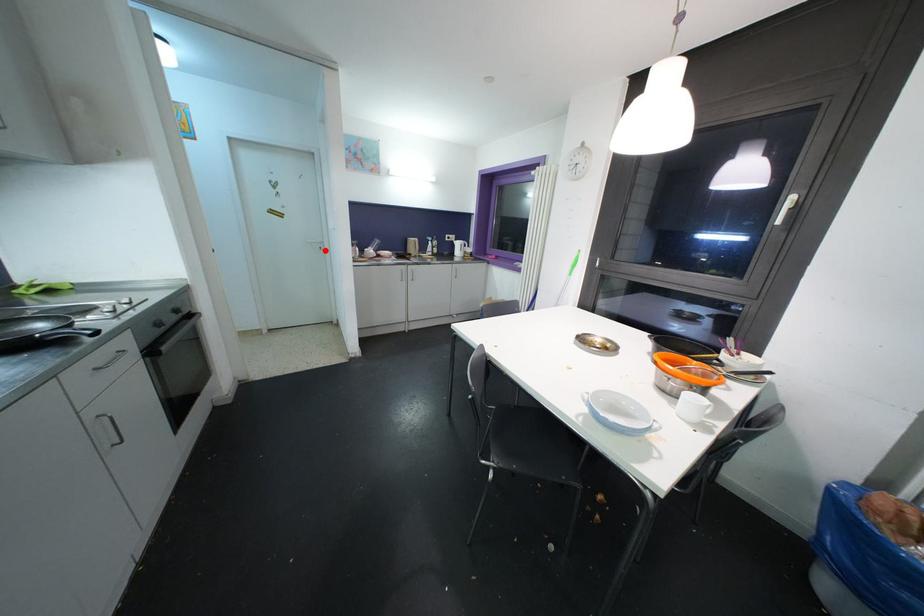
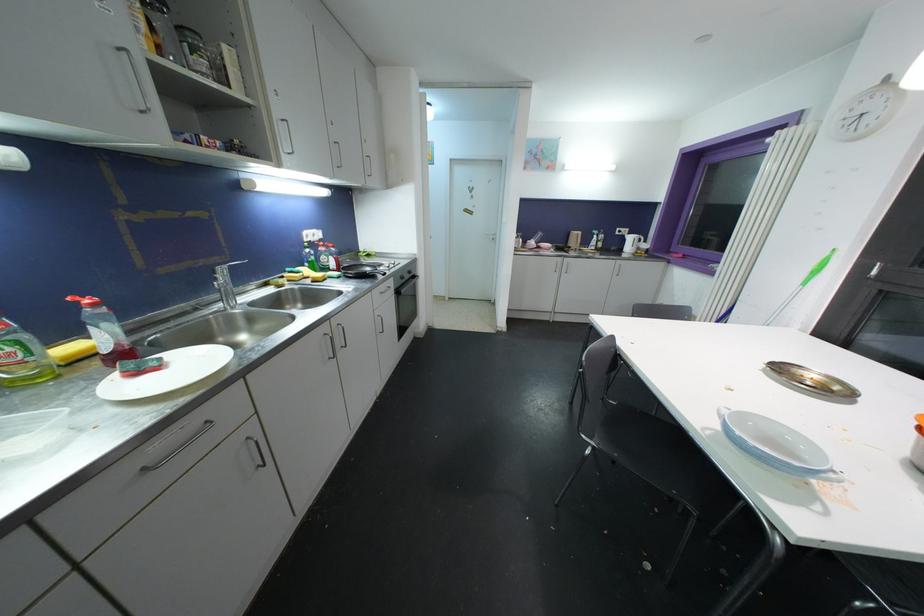
Where in the second image is the point corresponding to the highlighted location from the first image?

(496, 241)